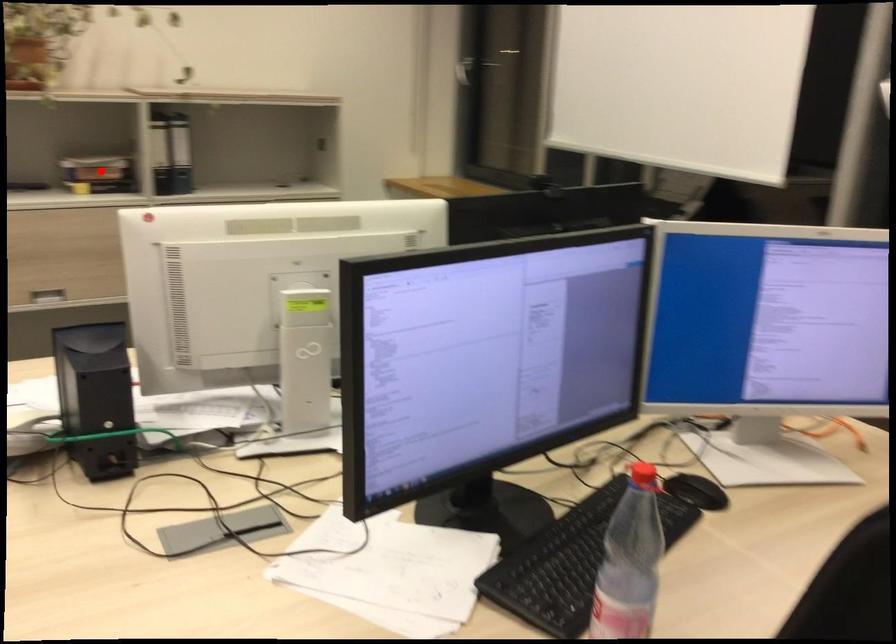
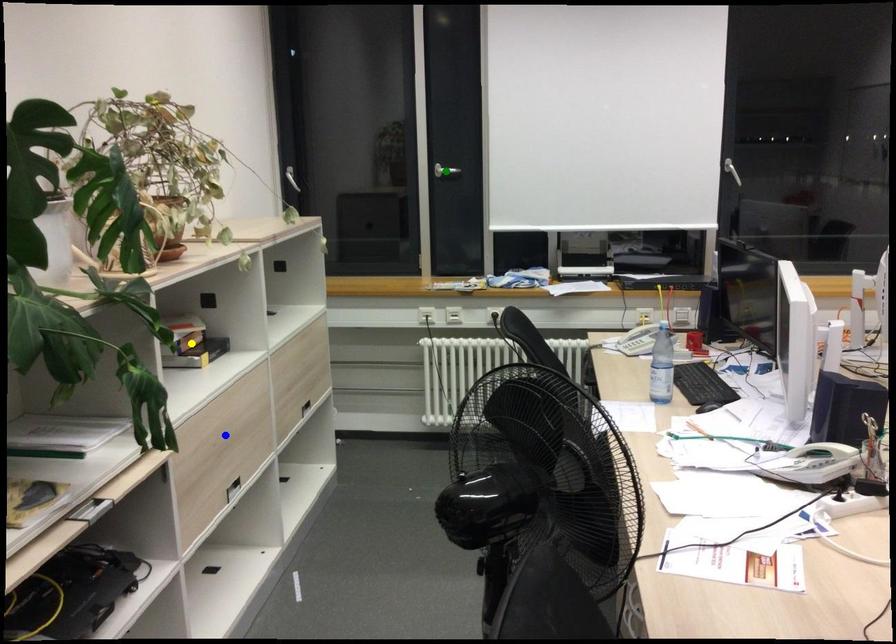
Question: I am providing you with two images of the same scene from different viewpoints. A red point is marked on the first image. You are given multiple points on the second image. Which spot in image 2 lines up with the point in image 1?

Choices:
 (A) yellow point
 (B) green point
 (C) blue point

Answer: (A)